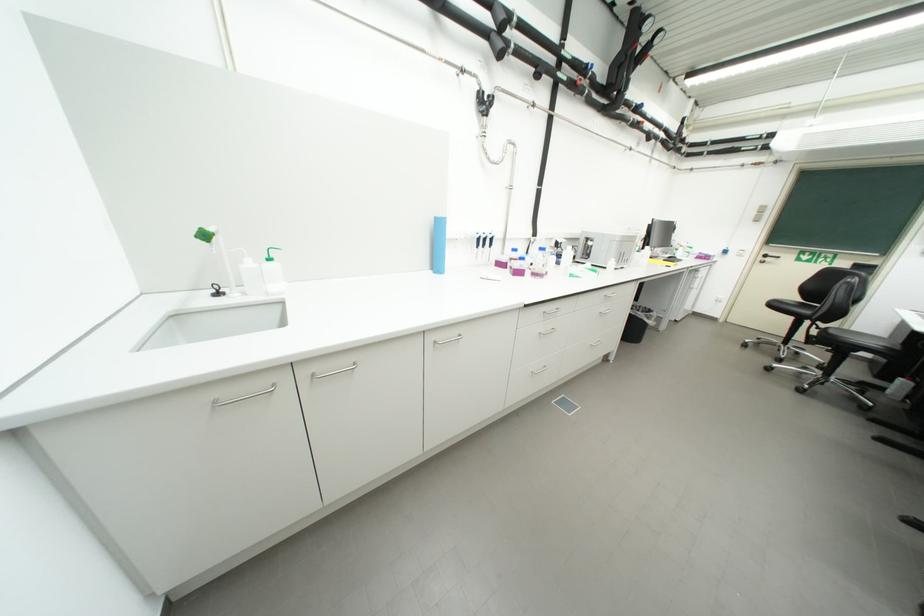
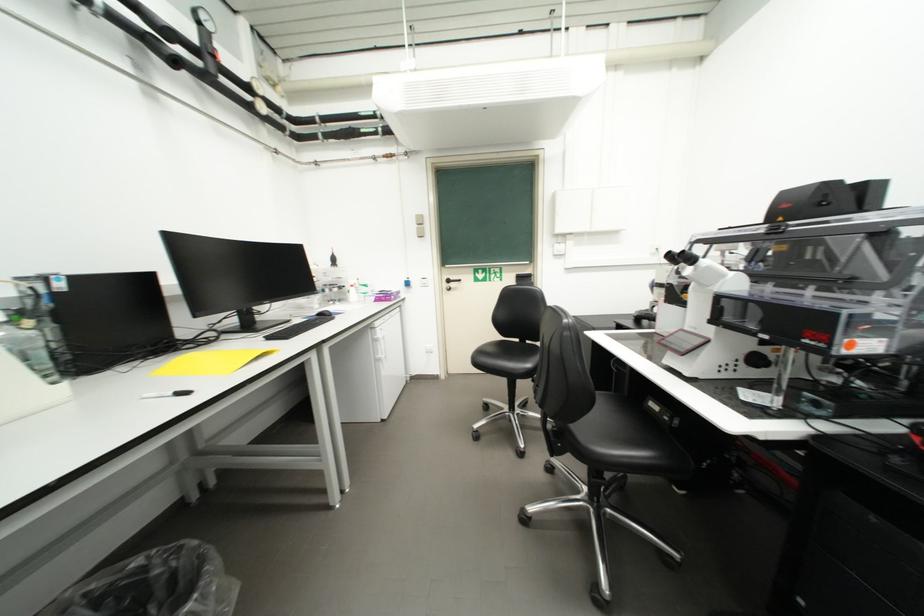
Locate, in the second image, the point that corresponds to point 773,257 in the first image.

(456, 283)